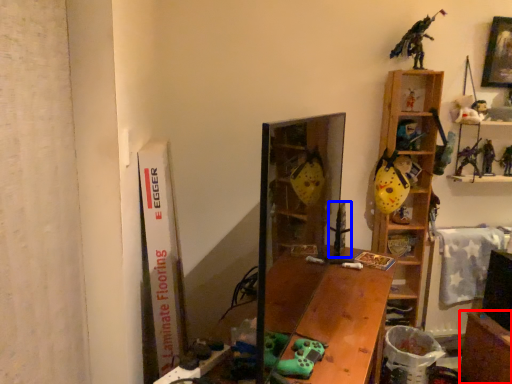
Question: Which point is closer to the camera, table (highlighted by a red box) or toy (highlighted by a blue box)?

Choices:
 (A) table
 (B) toy

Answer: (A)